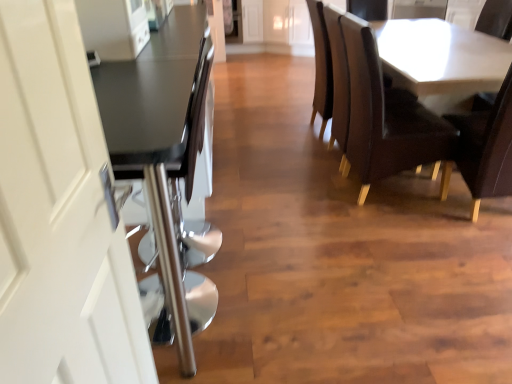
Locate an element on the screen. This screenshot has width=512, height=384. vacant space that's between leather seat at right, which ranks as the 2th chair in right-to-left order, and dark brown leather chair at right, which ranks as the 1th chair in right-to-left order is located at coordinates (418, 215).